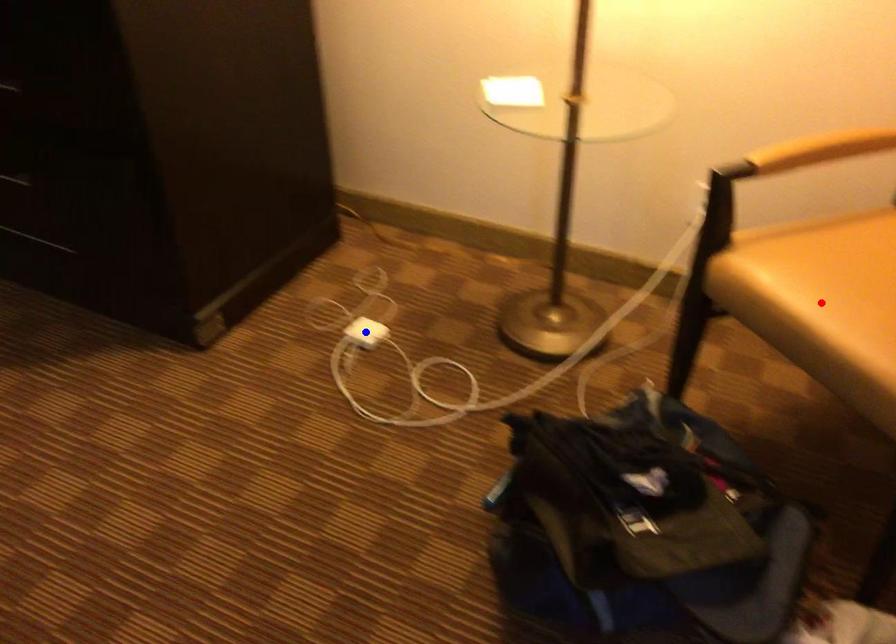
Question: Two points are marked on the image. Which point is closer to the camera?

Choices:
 (A) Blue point is closer.
 (B) Red point is closer.

Answer: (B)